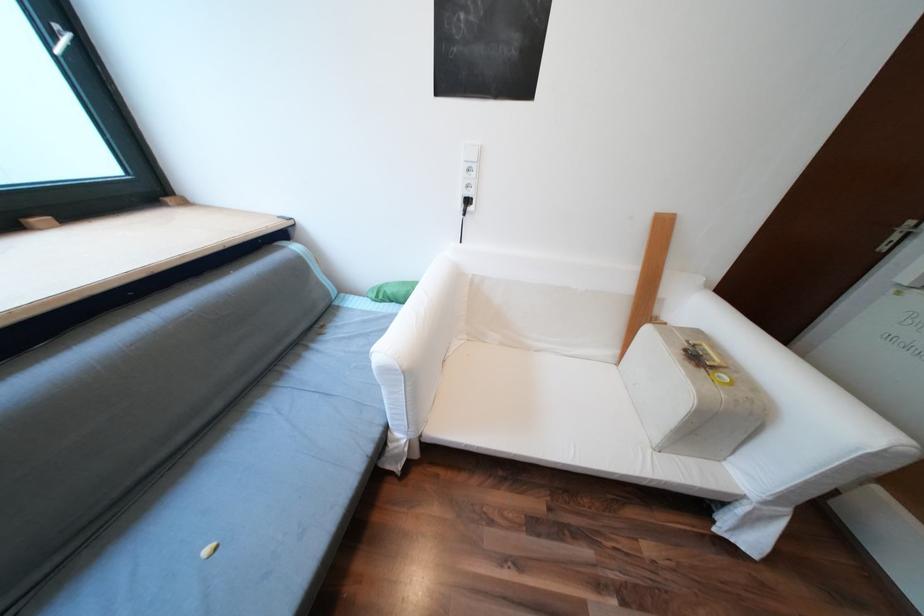
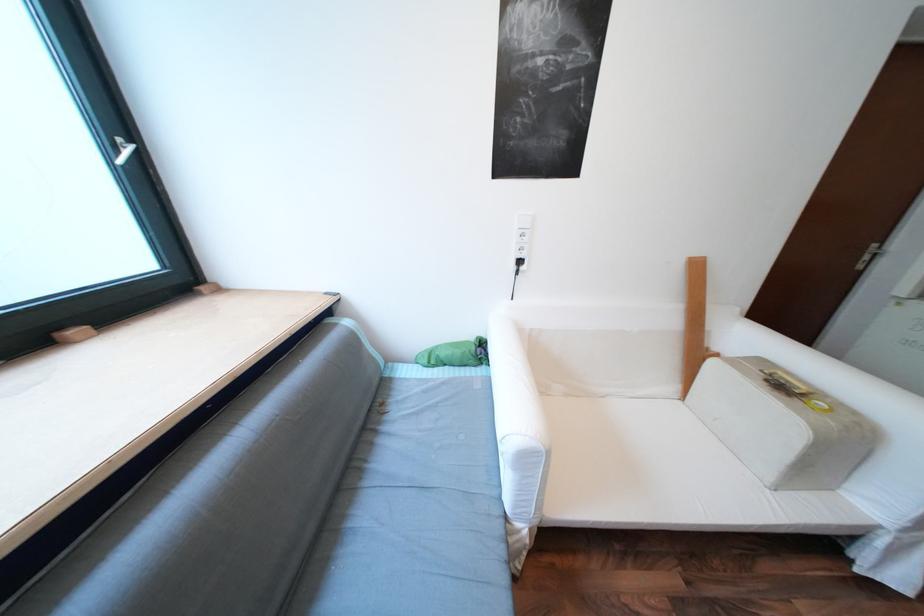
Question: Which direction would the cameraman need to move to produce the second image? Reply with the corresponding letter.

Choices:
 (A) Left
 (B) Right
 (C) Forward
 (D) Backward

Answer: (A)